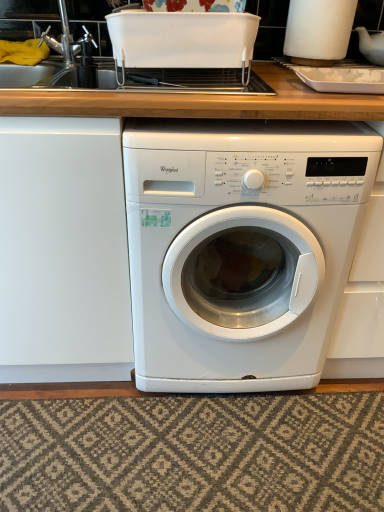
Find the location of a particular element. free space above textured beige rug at lower center (from a real-world perspective) is located at coordinates (201, 445).